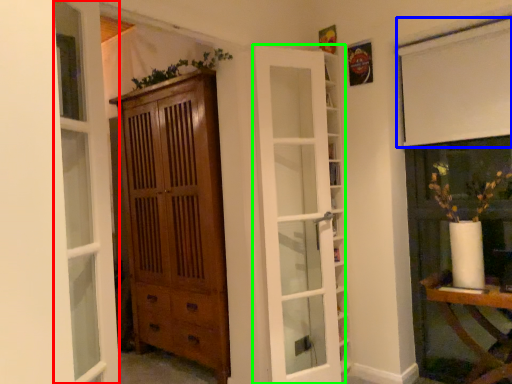
Question: Based on their relative distances, which object is farther from window (highlighted by a red box)? Choose from curtain (highlighted by a blue box) and door (highlighted by a green box).

Choices:
 (A) curtain
 (B) door

Answer: (A)